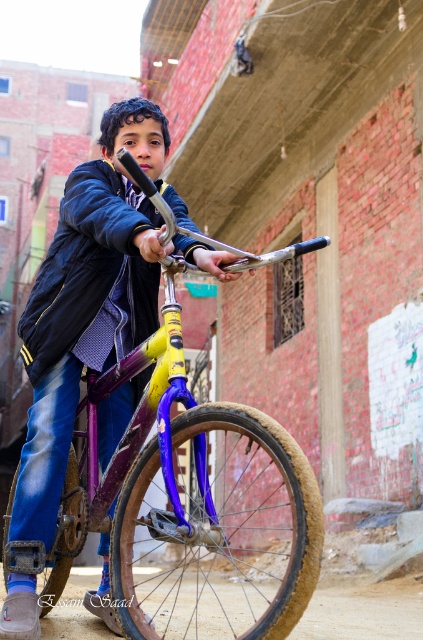
Can you confirm if yellow matte bicycle at center is taller than navy blue fabric jacket at center?

Yes, yellow matte bicycle at center is taller than navy blue fabric jacket at center.

Is yellow matte bicycle at center closer to the viewer compared to navy blue fabric jacket at center?

Yes, yellow matte bicycle at center is in front of navy blue fabric jacket at center.

Does point (313, 515) lie in front of point (62, 340)?

Yes.

What are the coordinates of `yellow matte bicycle at center` in the screenshot? It's located at (148, 442).